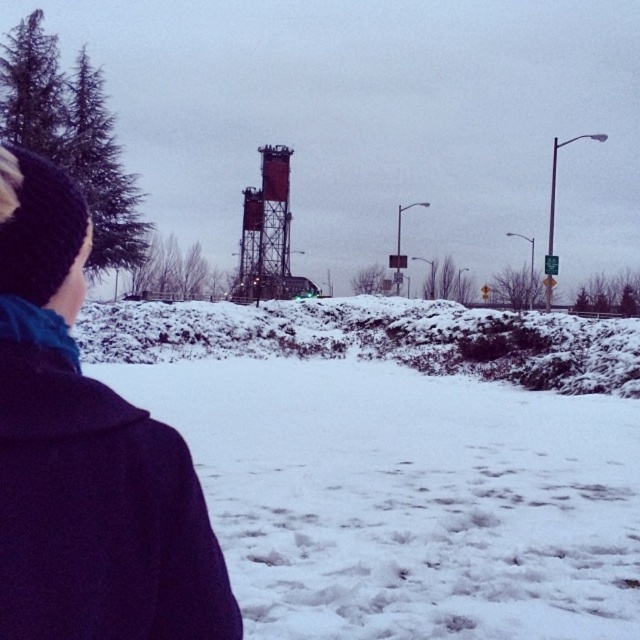
Question: Where is dark blue woolen coat at left located in relation to metallic water tower at center in the image?

Choices:
 (A) right
 (B) left

Answer: (A)

Question: Which object appears farthest from the camera in this image?

Choices:
 (A) metallic water tower at center
 (B) dark blue woolen coat at left

Answer: (A)

Question: Among these points, which one is nearest to the camera?

Choices:
 (A) (3, 524)
 (B) (266, 147)

Answer: (A)

Question: Can you confirm if dark blue woolen coat at left is smaller than metallic water tower at center?

Choices:
 (A) no
 (B) yes

Answer: (B)

Question: Is dark blue woolen coat at left thinner than metallic water tower at center?

Choices:
 (A) no
 (B) yes

Answer: (B)